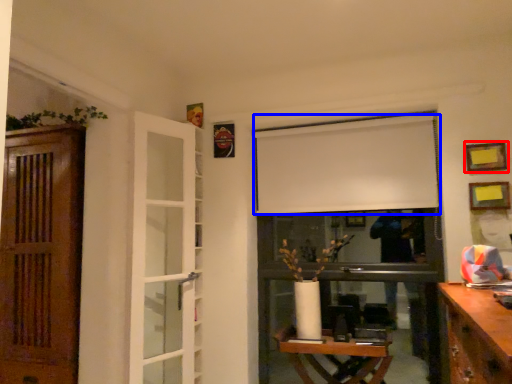
Question: Which object appears closest to the camera in this image, picture frame (highlighted by a red box) or curtain (highlighted by a blue box)?

Choices:
 (A) picture frame
 (B) curtain

Answer: (A)